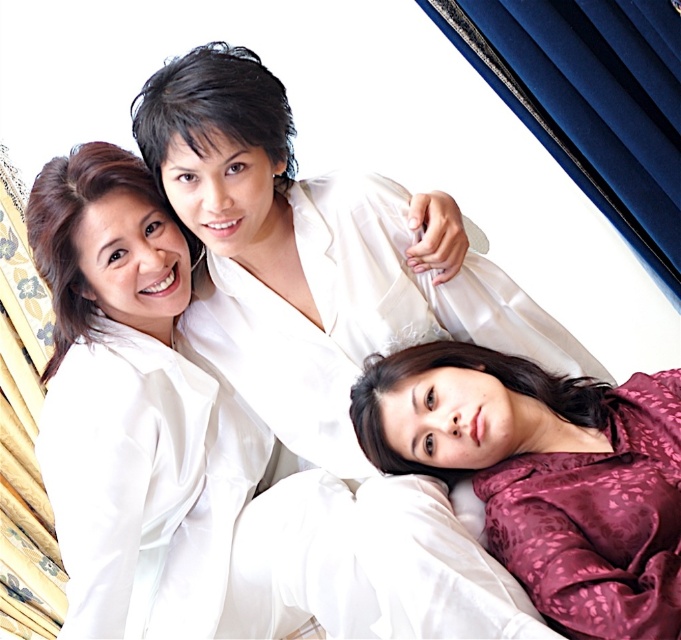
Question: Which point appears closest to the camera in this image?

Choices:
 (A) (445, 426)
 (B) (332, 266)
 (C) (240, 276)
 (D) (65, 480)

Answer: (A)

Question: Can you confirm if matte white shirt at upper left is smaller than silky purple pajamas at lower right?

Choices:
 (A) yes
 (B) no

Answer: (B)

Question: Is silky purple robe at center bigger than matte white shirt at upper left?

Choices:
 (A) yes
 (B) no

Answer: (A)

Question: Which point is farther from the camera taking this photo?

Choices:
 (A) (577, 476)
 (B) (379, 492)
 (C) (197, 241)
 (D) (449, 330)

Answer: (D)

Question: Which object appears farthest from the camera in this image?

Choices:
 (A) silky purple robe at center
 (B) matte white shirt at upper left
 (C) white satin shirt at center
 (D) silky purple pajamas at lower right

Answer: (B)

Question: Does white satin shirt at center appear on the left side of silky purple pajamas at lower right?

Choices:
 (A) no
 (B) yes

Answer: (B)